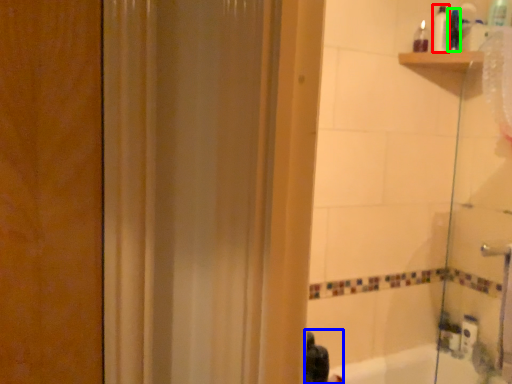
Question: Which object is the closest to the toiletry (highlighted by a red box)? Choose among these: person (highlighted by a blue box) or toiletry (highlighted by a green box).

Choices:
 (A) person
 (B) toiletry

Answer: (B)